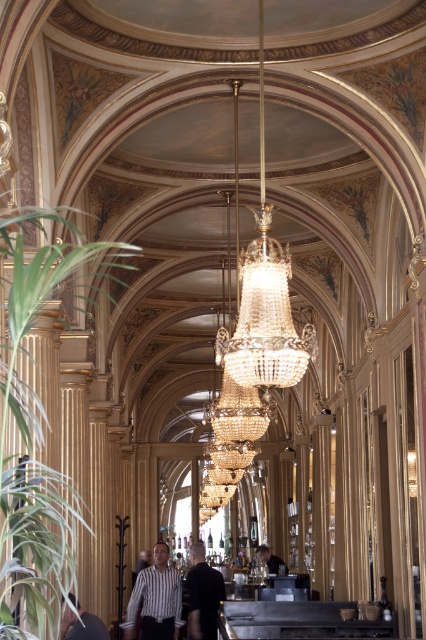
You are standing in the grand hallway and want to hang a new painting between the green leafy plant at left and the striped fabric shirt at lower left. Can you determine which object is higher to position the painting appropriately?

The green leafy plant at left is above the striped fabric shirt at lower left, so you should position the painting between them by placing it below the green leafy plant at left and above the striped fabric shirt at lower left.

You are a fashion designer observing the striped fabric shirt at lower left and the dark brown leather jacket at center in the image. Which clothing item appears narrower in width?

The striped fabric shirt at lower left has a lesser width compared to the dark brown leather jacket at center, so the striped fabric shirt at lower left is narrower in width.